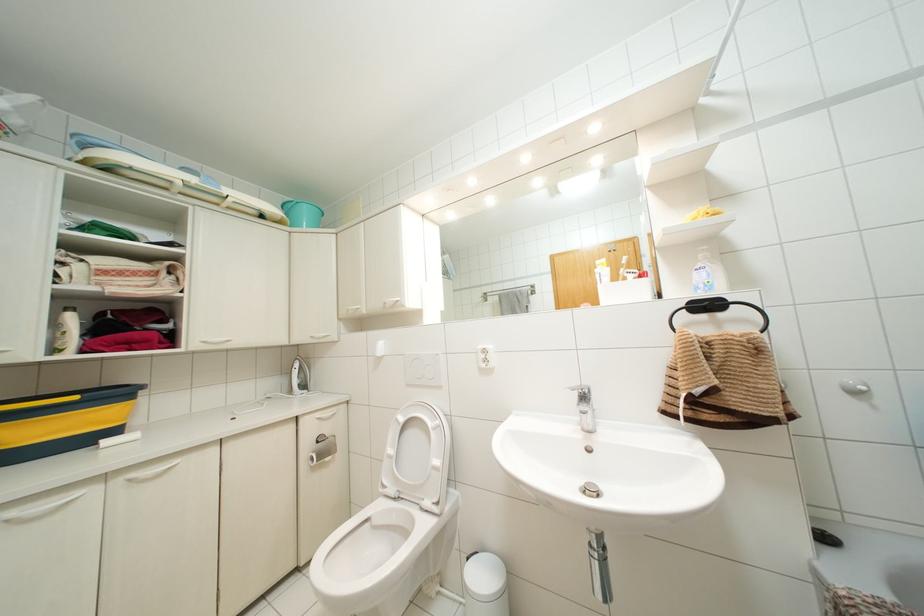
The location [322,448] corresponds to which object?

It refers to a toilet paper roll.